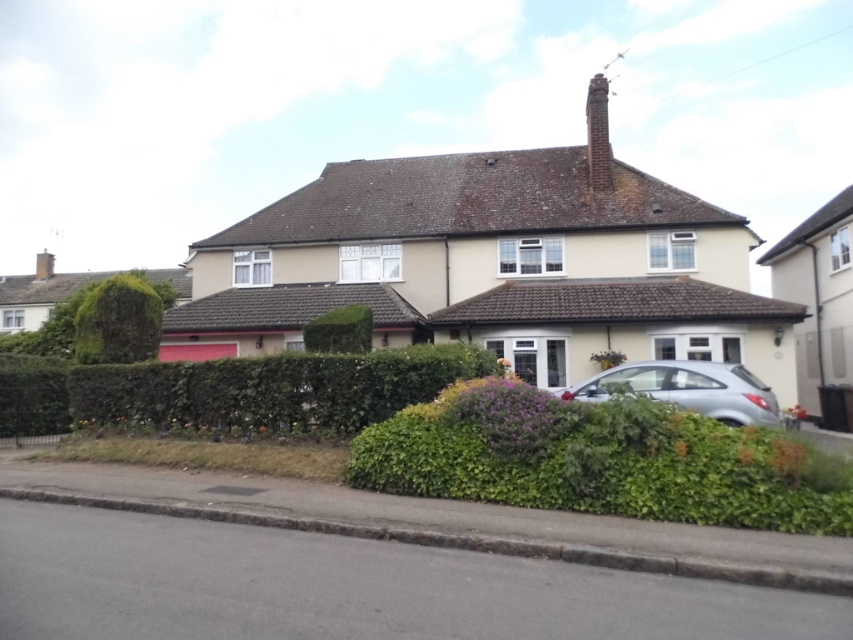
Is point (93, 340) positioned in front of point (347, 320)?

Yes, it is in front of point (347, 320).

Does point (107, 316) come closer to viewer compared to point (312, 332)?

That is True.

Identify the location of green leafy bush at left. (119, 321).

Does satin silver car at right have a greater width compared to green leafy bush at left?

No, satin silver car at right is not wider than green leafy bush at left.

This screenshot has height=640, width=853. Find the location of `satin silver car at right`. satin silver car at right is located at coordinates (688, 388).

Identify the location of satin silver car at right. (688, 388).

Is point (115, 320) less distant than point (590, 179)?

Yes, it is.

Does green leafy bush at left have a greater width compared to brick chimney at upper center?

Incorrect, green leafy bush at left's width does not surpass brick chimney at upper center's.

Locate an element on the screen. green leafy bush at left is located at coordinates (119, 321).

In order to click on green leafy bush at left in this screenshot , I will do coord(119,321).